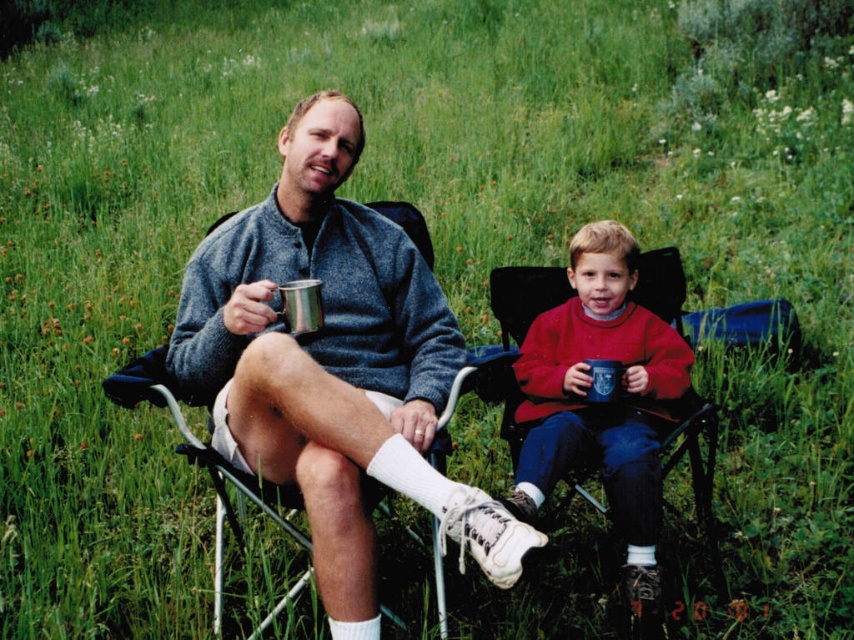
Does matte red sweater at center have a larger size compared to metallic folding chair at center?

No, matte red sweater at center is not bigger than metallic folding chair at center.

Measure the distance between point (x=531, y=388) and camera.

A distance of 8.76 feet exists between point (x=531, y=388) and camera.

What do you see at coordinates (601, 400) in the screenshot?
I see `matte red sweater at center` at bounding box center [601, 400].

The height and width of the screenshot is (640, 854). I want to click on matte red sweater at center, so (601, 400).